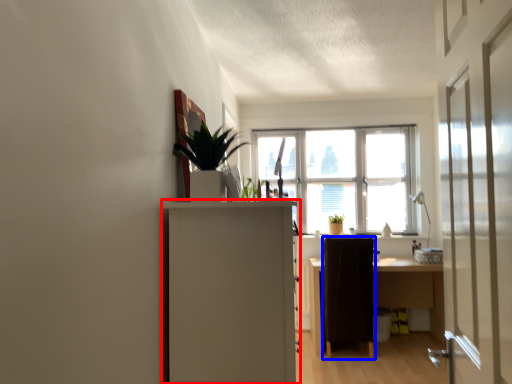
Question: Which of the following is the closest to the observer, cabinetry (highlighted by a red box) or furniture (highlighted by a blue box)?

Choices:
 (A) cabinetry
 (B) furniture

Answer: (A)